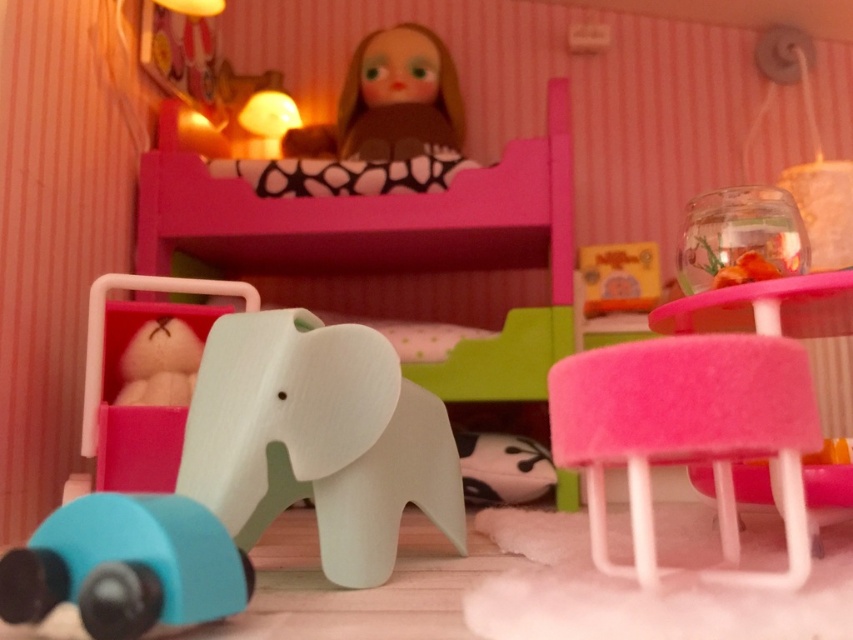
Question: Can you confirm if pink matte bunk bed at upper center is positioned above white matte elephant at center?

Choices:
 (A) no
 (B) yes

Answer: (B)

Question: Is fuzzy pink stool at lower right in front of matte brown doll at upper center?

Choices:
 (A) no
 (B) yes

Answer: (B)

Question: Is fuzzy pink stool at lower right above white matte elephant at center?

Choices:
 (A) yes
 (B) no

Answer: (A)

Question: Which point appears farthest from the camera in this image?

Choices:
 (A) (459, 100)
 (B) (181, 396)
 (C) (515, 499)

Answer: (A)

Question: Which is nearer to the white plush bear at left?

Choices:
 (A) white matte elephant at center
 (B) pink matte bunk bed at upper center
 (C) fuzzy pink stool at lower right

Answer: (B)

Question: Which point appears farthest from the camera in this image?

Choices:
 (A) (164, 404)
 (B) (78, 534)

Answer: (A)